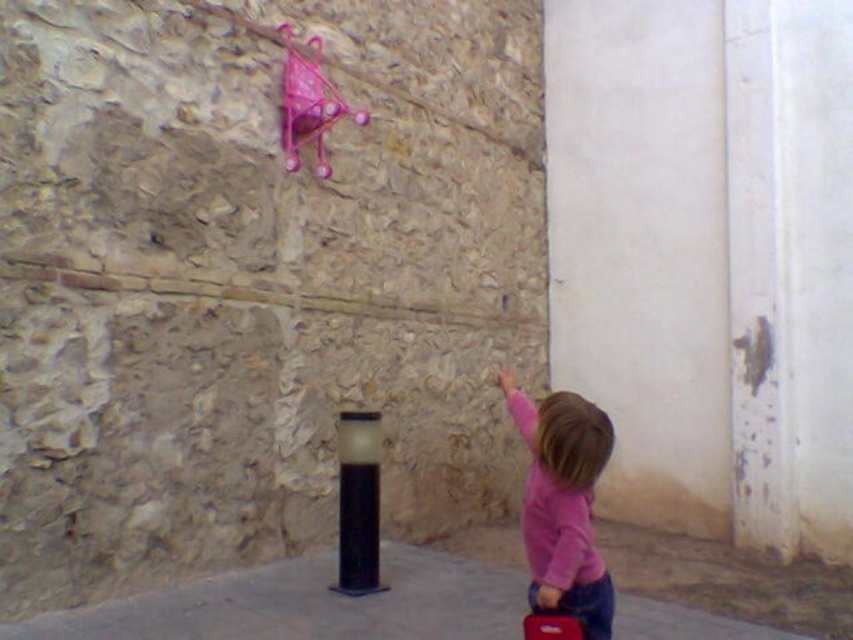
Question: Which object is the farthest from the gray concrete pavement at center?

Choices:
 (A) matte red suitcase at lower center
 (B) pink matte shirt at center

Answer: (B)

Question: Where is gray concrete pavement at center located in relation to black matte pole at center in the image?

Choices:
 (A) above
 (B) below

Answer: (B)

Question: Which object is closer to the camera taking this photo?

Choices:
 (A) gray concrete pavement at center
 (B) black matte pole at center

Answer: (A)

Question: Is gray concrete pavement at center below pink matte shirt at center?

Choices:
 (A) yes
 (B) no

Answer: (A)

Question: Which point is farther from the camera taking this photo?

Choices:
 (A) (364, 502)
 (B) (579, 488)
 (C) (491, 618)
 (D) (579, 630)

Answer: (A)

Question: Does pink matte shirt at center come in front of black matte pole at center?

Choices:
 (A) yes
 (B) no

Answer: (A)